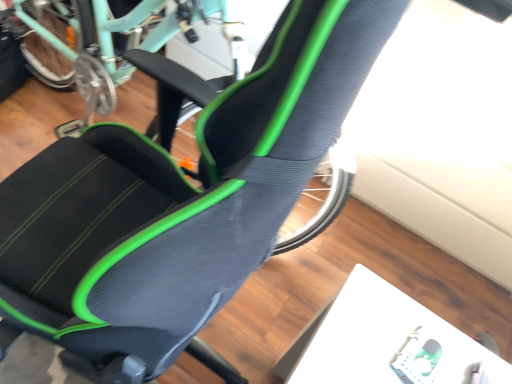
The height and width of the screenshot is (384, 512). Find the location of `matte teal bicycle at upper left`. matte teal bicycle at upper left is located at coordinates (64, 53).

What do you see at coordinates (64, 53) in the screenshot? I see `matte teal bicycle at upper left` at bounding box center [64, 53].

Locate an element on the screen. matte teal bicycle at upper left is located at coordinates (64, 53).